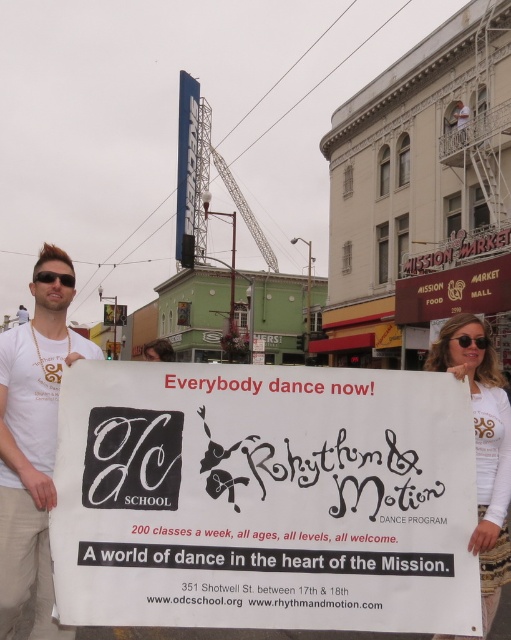
Does white paper sign at center appear under white t-shirt at left?

Correct, white paper sign at center is located below white t-shirt at left.

Is white paper sign at center smaller than white t-shirt at left?

Indeed, white paper sign at center has a smaller size compared to white t-shirt at left.

Describe the element at coordinates (264, 499) in the screenshot. I see `white paper sign at center` at that location.

Locate an element on the screen. The width and height of the screenshot is (511, 640). white paper sign at center is located at coordinates (264, 499).

Who is shorter, white t-shirt at left or black plastic sunglasses at upper right?

black plastic sunglasses at upper right is shorter.

Is white t-shirt at left wider than black plastic sunglasses at upper right?

Yes.

Does point (22, 406) come in front of point (475, 340)?

Yes, it is.

Where is `white t-shirt at left`? This screenshot has height=640, width=511. white t-shirt at left is located at coordinates (33, 452).

Is point (486, 552) positioned behind point (480, 333)?

No, (486, 552) is in front of (480, 333).

This screenshot has height=640, width=511. Describe the element at coordinates (482, 454) in the screenshot. I see `white printed sign at center` at that location.

At what (x,y) coordinates should I click in order to perform the action: click on white printed sign at center. Please return your answer as a coordinate pair (x, y). Looking at the image, I should click on (482, 454).